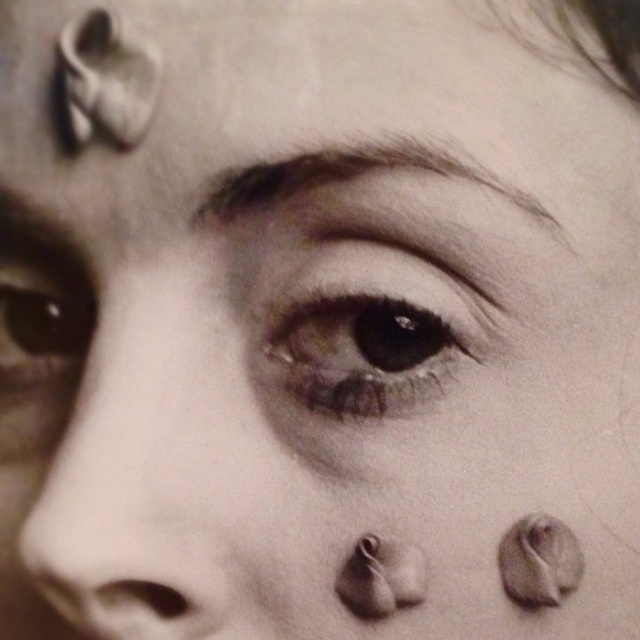
You are an artist trying to paint the coffee beans around the eye area. You have two points marked on your canvas at point (x=349, y=305) and point (x=4, y=298). Which point should you paint first if you want to follow the correct layering based on their depth?

You should paint point (x=349, y=305) first because it is closer to the viewer than point (x=4, y=298), so it should be layered on top.

You are an artist creating a digital portrait of the person in the image. You need to place a virtual coffee bean exactly where the smooth skin nose at center is located. What are the coordinates you should use?

The coordinates for the smooth skin nose at center are at point (118, 522).